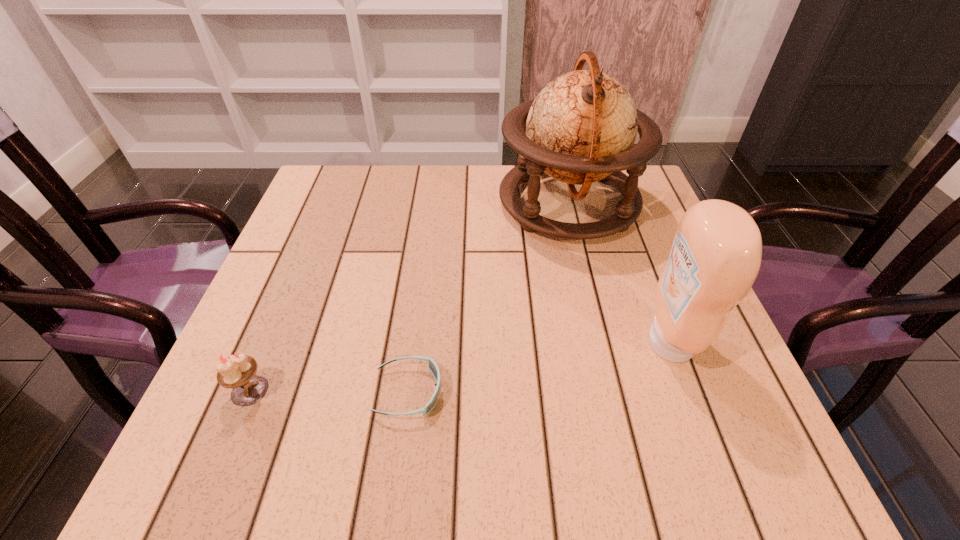
I want to click on free point located 0.260m on the label of the condiment, so click(502, 342).

Image resolution: width=960 pixels, height=540 pixels. I want to click on free space located on the back of the candle holder, so click(x=315, y=234).

I want to click on free spot located on the front-facing side of the shortest object, so click(x=485, y=392).

The image size is (960, 540). Identify the location of object present at the far edge. (581, 128).

At what (x,y) coordinates should I click in order to perform the action: click on object that is at the near edge. Please return your answer as a coordinate pair (x, y). The width and height of the screenshot is (960, 540). Looking at the image, I should click on (432, 366).

Where is `object that is positioned at the left edge`? This screenshot has height=540, width=960. object that is positioned at the left edge is located at coordinates (235, 371).

Identify the location of globe that is at the right edge. The height and width of the screenshot is (540, 960). (581, 128).

This screenshot has width=960, height=540. I want to click on condiment positioned at the right edge, so click(716, 254).

This screenshot has height=540, width=960. I want to click on object that is at the far right corner, so click(581, 128).

This screenshot has width=960, height=540. In order to click on vacant space at the far edge of the desktop in this screenshot , I will do `click(399, 177)`.